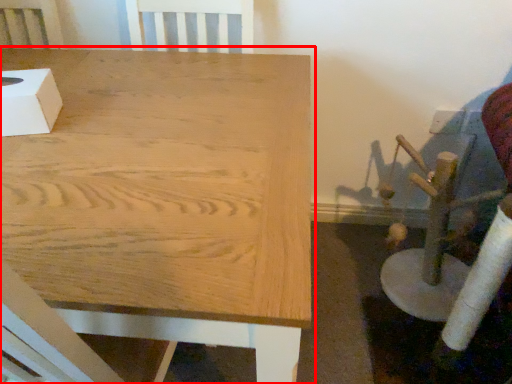
Question: From the image's perspective, considering the relative positions of table (annotated by the red box) and box in the image provided, where is table (annotated by the red box) located with respect to the staircase?

Choices:
 (A) above
 (B) below

Answer: (B)